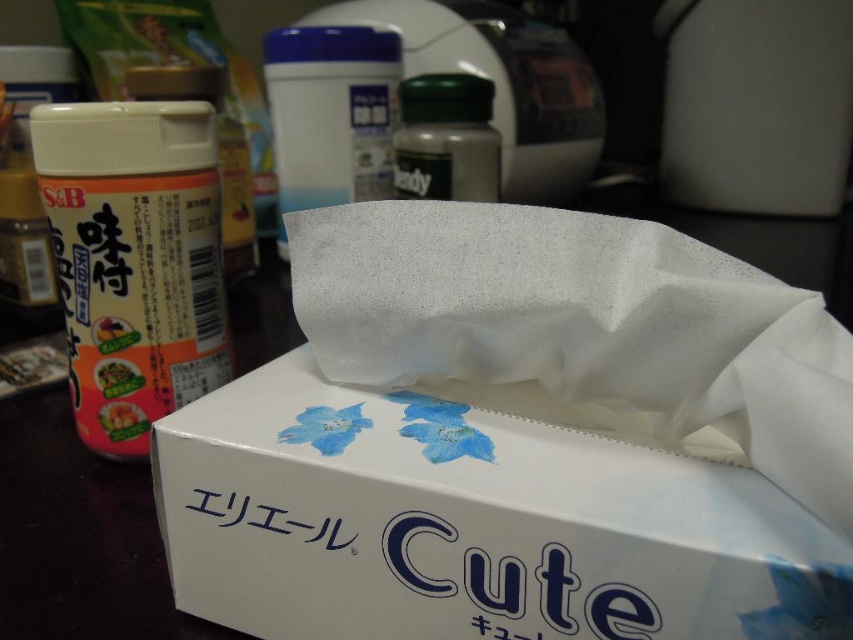
You are organizing items on a kitchen counter and need to place the white cardboard box at center and the orange matte seasoning at left. If you want to arrange them so that the larger item is to the right of the smaller one, which item should be placed on the right side?

The white cardboard box at center is larger than the orange matte seasoning at left, so the white cardboard box at center should be placed on the right side.

You are organizing items on a kitchen counter and see the white cardboard box at center and the orange matte seasoning at left. Which item is positioned lower on the counter?

The white cardboard box at center is located below the orange matte seasoning at left, so it is positioned lower on the counter.

You are organizing items on a counter and need to place a new item between the white cardboard box at center and the orange matte seasoning at left. The new item is 10 inches long. Will there be enough space between them to fit it?

The distance between the white cardboard box at center and the orange matte seasoning at left is 20.89 inches. Since the new item is 10 inches long, there is sufficient space to place it between them.